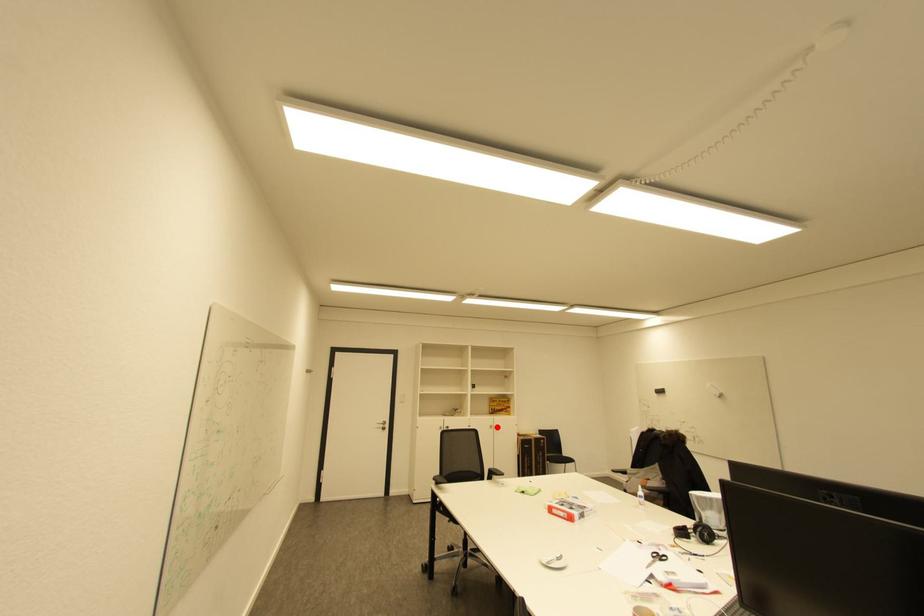
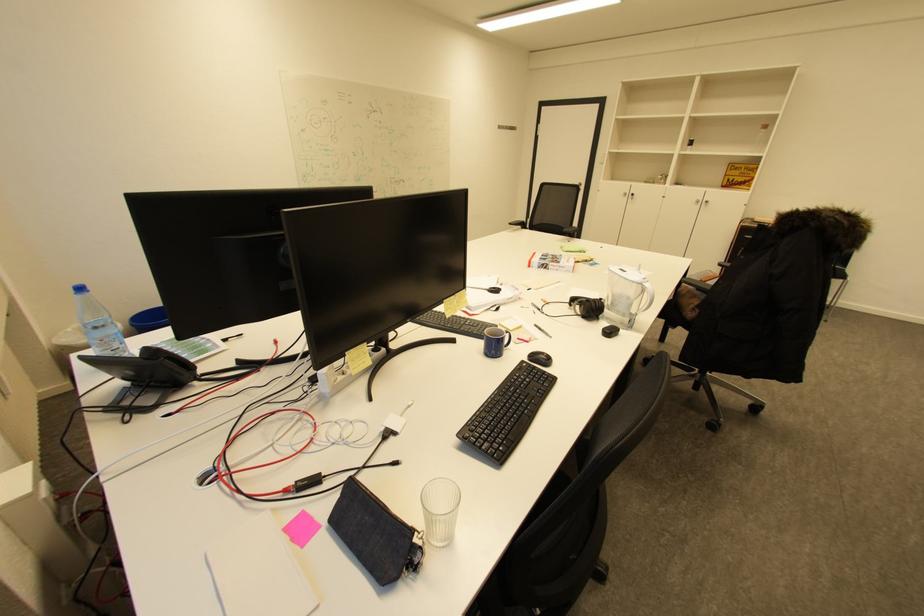
Locate, in the second image, the point that corresponds to the highlighted location in the first image.

(703, 201)